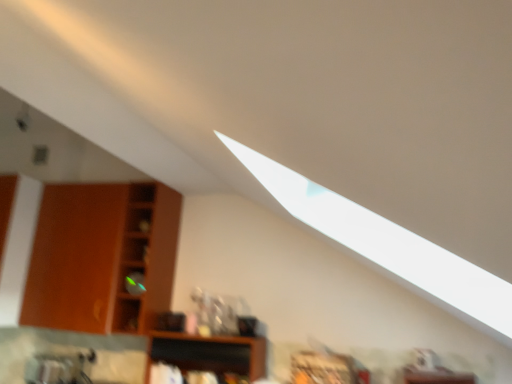
Question: Can you confirm if wooden cabinet at left, which appears as the second shelf when ordered from the bottom, is positioned to the right of wooden at center, marked as the 1th shelf in a bottom-to-top arrangement?

Choices:
 (A) no
 (B) yes

Answer: (A)

Question: From the image's perspective, is wooden cabinet at left, placed as the 1th shelf when sorted from top to bottom, beneath wooden at center, marked as the 1th shelf in a bottom-to-top arrangement?

Choices:
 (A) no
 (B) yes

Answer: (A)

Question: Is wooden cabinet at left, placed as the 1th shelf when sorted from top to bottom, facing towards wooden at center, placed as the 2th shelf when sorted from left to right?

Choices:
 (A) no
 (B) yes

Answer: (A)

Question: Considering the relative sizes of wooden cabinet at left, which ranks as the second shelf in right-to-left order, and wooden at center, placed as the 2th shelf when sorted from left to right, in the image provided, is wooden cabinet at left, which ranks as the second shelf in right-to-left order, shorter than wooden at center, placed as the 2th shelf when sorted from left to right,?

Choices:
 (A) yes
 (B) no

Answer: (B)

Question: Considering the relative positions of wooden cabinet at left, which appears as the second shelf when ordered from the bottom, and wooden at center, the second shelf positioned from the top, in the image provided, is wooden cabinet at left, which appears as the second shelf when ordered from the bottom, in front of wooden at center, the second shelf positioned from the top,?

Choices:
 (A) no
 (B) yes

Answer: (A)

Question: Is wooden cabinet at left, which appears as the second shelf when ordered from the bottom, positioned beyond the bounds of wooden at center, the 1th shelf when ordered from right to left?

Choices:
 (A) no
 (B) yes

Answer: (B)

Question: Does wooden at center, the second shelf positioned from the top, touch wooden cabinet at left, which appears as the first shelf when viewed from the left?

Choices:
 (A) yes
 (B) no

Answer: (B)

Question: From a real-world perspective, does wooden at center, the 1th shelf when ordered from right to left, sit lower than wooden cabinet at left, which ranks as the second shelf in right-to-left order?

Choices:
 (A) no
 (B) yes

Answer: (B)

Question: Does wooden at center, marked as the 1th shelf in a bottom-to-top arrangement, come behind wooden cabinet at left, which ranks as the second shelf in right-to-left order?

Choices:
 (A) no
 (B) yes

Answer: (A)

Question: Does wooden at center, placed as the 2th shelf when sorted from left to right, have a lesser height compared to wooden cabinet at left, which appears as the second shelf when ordered from the bottom?

Choices:
 (A) yes
 (B) no

Answer: (A)

Question: Does wooden at center, placed as the 2th shelf when sorted from left to right, have a greater height compared to wooden cabinet at left, which ranks as the second shelf in right-to-left order?

Choices:
 (A) no
 (B) yes

Answer: (A)

Question: Is the position of wooden at center, marked as the 1th shelf in a bottom-to-top arrangement, less distant than that of wooden cabinet at left, which ranks as the second shelf in right-to-left order?

Choices:
 (A) no
 (B) yes

Answer: (B)

Question: Relative to wooden at center, the 1th shelf when ordered from right to left, is wooden cabinet at left, placed as the 1th shelf when sorted from top to bottom, in front or behind?

Choices:
 (A) behind
 (B) front

Answer: (A)